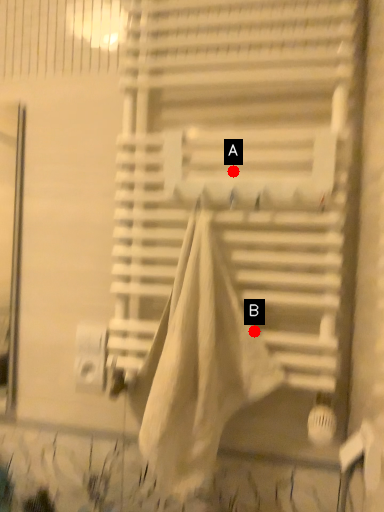
Question: Two points are circled on the image, labeled by A and B beside each circle. Which point is closer to the camera taking this photo?

Choices:
 (A) A is closer
 (B) B is closer

Answer: (A)